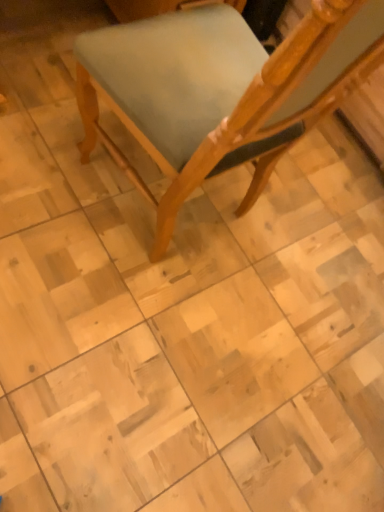
Question: Should I look upward or downward to see wooden chair at center?

Choices:
 (A) up
 (B) down

Answer: (A)